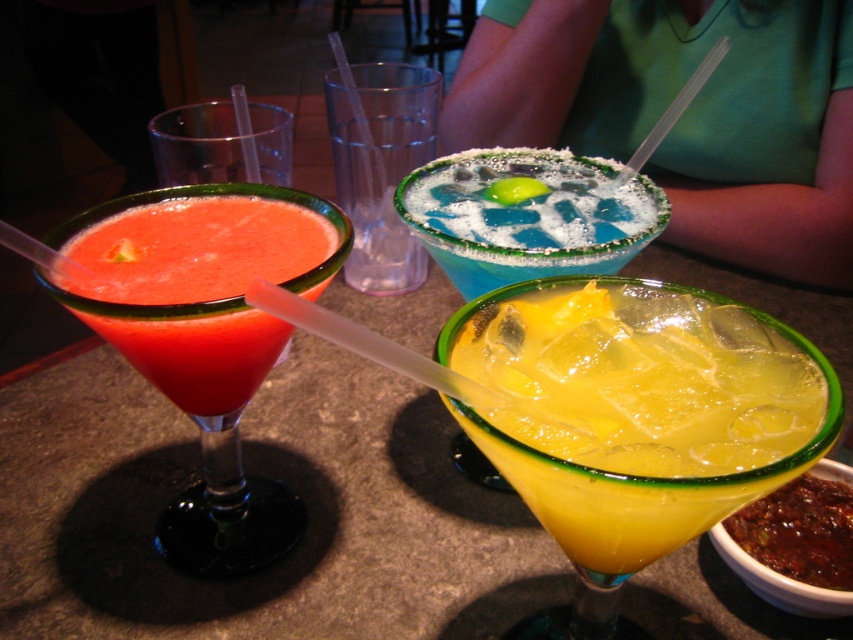
Between point (627, 182) and point (273, 152), which one is positioned in front?

Point (627, 182) is more forward.

Can you confirm if translucent blue margarita at center is positioned above transparent plastic cup at upper left?

Actually, translucent blue margarita at center is below transparent plastic cup at upper left.

Is point (502, 227) positioned in front of point (163, 176)?

That is True.

What are the coordinates of `translucent blue margarita at center` in the screenshot? It's located at (526, 218).

This screenshot has width=853, height=640. Describe the element at coordinates (683, 113) in the screenshot. I see `blue salted margarita at center` at that location.

Which is behind, point (751, 266) or point (531, 243)?

The point (751, 266) is more distant.

Is point (461, 129) positioned behind point (485, 244)?

That is True.

Identify the location of blue salted margarita at center. (683, 113).

Is translucent plastic cup at center below transparent plastic cup at upper left?

Actually, translucent plastic cup at center is above transparent plastic cup at upper left.

Is translucent plastic cup at center bigger than transparent plastic cup at upper left?

Yes.

This screenshot has width=853, height=640. What do you see at coordinates (381, 166) in the screenshot?
I see `translucent plastic cup at center` at bounding box center [381, 166].

In order to click on translucent plastic cup at center in this screenshot , I will do `click(381, 166)`.